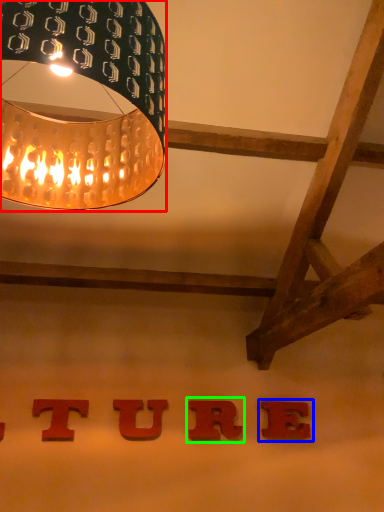
Question: Considering the real-world distances, which object is farthest from lamp (highlighted by a red box)? alphabet (highlighted by a blue box) or alphabet (highlighted by a green box)?

Choices:
 (A) alphabet
 (B) alphabet

Answer: (A)